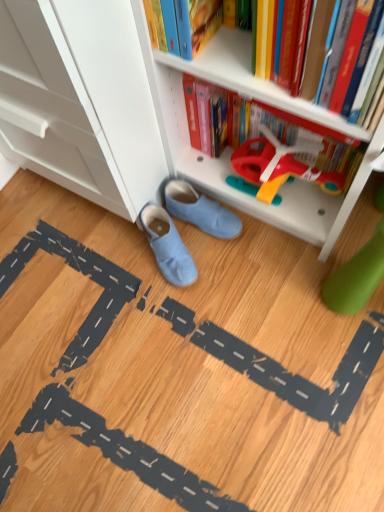
The width and height of the screenshot is (384, 512). In order to click on vacant region in front of white plastic bookcase at lower center in this screenshot , I will do tap(265, 320).